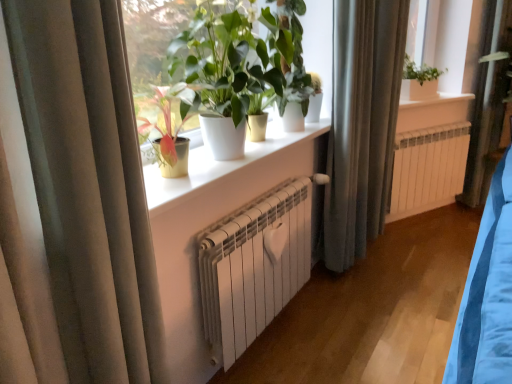
Find the location of a particular element. The width and height of the screenshot is (512, 384). vacant area that lies to the right of silky gray curtain at center, which is the second curtain from left to right is located at coordinates (x=386, y=271).